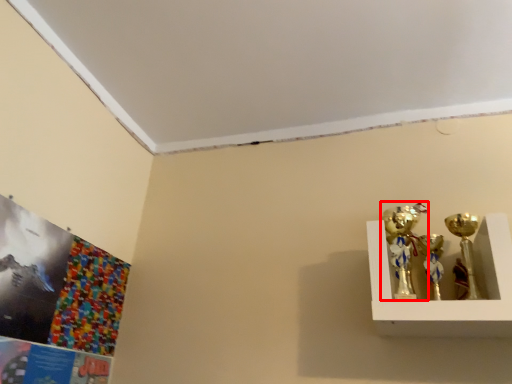
Question: From the image's perspective, what is the correct spatial positioning of candle holder (annotated by the red box) in reference to candle holder?

Choices:
 (A) below
 (B) above

Answer: (B)